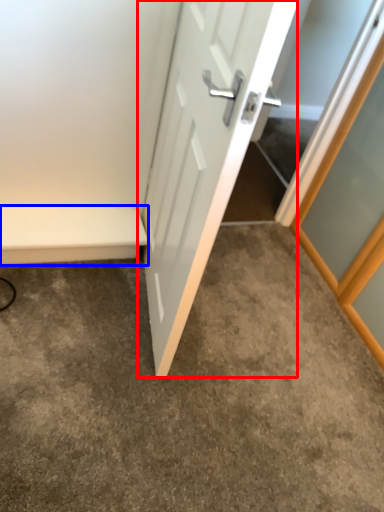
Question: Which of the following is the farthest to the observer, door (highlighted by a red box) or balustrade (highlighted by a blue box)?

Choices:
 (A) door
 (B) balustrade

Answer: (B)